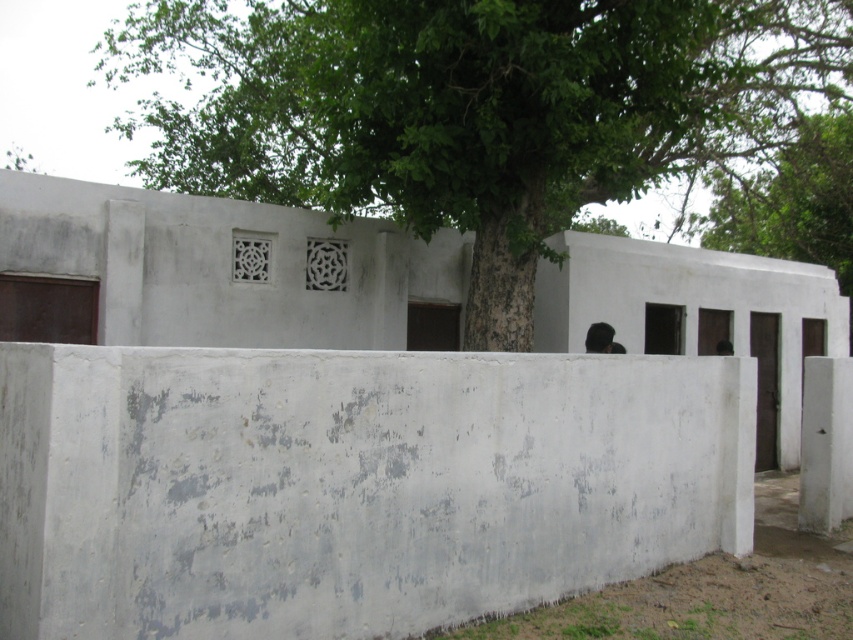
Question: Is green rough bark tree at center bigger than green leafy tree at upper center?

Choices:
 (A) no
 (B) yes

Answer: (B)

Question: Which point appears farthest from the camera in this image?

Choices:
 (A) (445, 364)
 (B) (302, 49)

Answer: (B)

Question: Does green rough bark tree at center appear under green leafy tree at upper center?

Choices:
 (A) yes
 (B) no

Answer: (B)

Question: Based on their relative distances, which object is nearer to the green leafy tree at upper center?

Choices:
 (A) green rough bark tree at center
 (B) gray concrete wall at center

Answer: (A)

Question: Which point appears closest to the camera in this image?

Choices:
 (A) (820, 44)
 (B) (821, 227)
 (C) (41, 538)

Answer: (C)

Question: Is gray concrete wall at center behind green leafy tree at upper center?

Choices:
 (A) yes
 (B) no

Answer: (B)